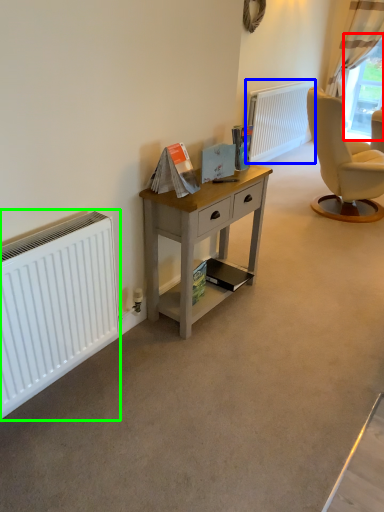
Question: Based on their relative distances, which object is farther from window screen (highlighted by a red box)? Choose from radiator (highlighted by a blue box) and radiator (highlighted by a green box).

Choices:
 (A) radiator
 (B) radiator

Answer: (B)